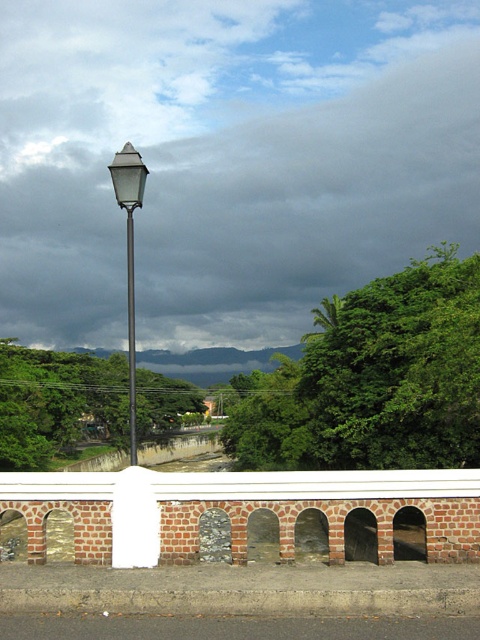
Which is below, green leafy tree at upper center or metallic streetlight at center?

green leafy tree at upper center is lower down.

Describe the element at coordinates (374, 380) in the screenshot. I see `green leafy tree at upper center` at that location.

This screenshot has width=480, height=640. Find the location of `green leafy tree at upper center`. green leafy tree at upper center is located at coordinates [x=374, y=380].

This screenshot has height=640, width=480. What are the coordinates of `green leafy tree at upper center` in the screenshot? It's located at (374, 380).

Can you confirm if green leafy tree at upper center is thinner than matte metal pole at center?

In fact, green leafy tree at upper center might be wider than matte metal pole at center.

Is point (277, 456) in front of point (127, 256)?

Yes, point (277, 456) is closer to viewer.

At what (x,y) coordinates should I click in order to perform the action: click on green leafy tree at upper center. Please return your answer as a coordinate pair (x, y). Image resolution: width=480 pixels, height=640 pixels. Looking at the image, I should click on (374, 380).

Locate an element on the screen. green leafy tree at upper center is located at coordinates (374, 380).

Which is above, green leafy tree at center or metallic streetlight at center?

Positioned higher is metallic streetlight at center.

Does point (74, 445) lie behind point (118, 192)?

That is True.

Between point (70, 419) and point (134, 184), which one is positioned behind?

The point (70, 419) is behind.

This screenshot has width=480, height=640. Identify the location of green leafy tree at center. (59, 404).